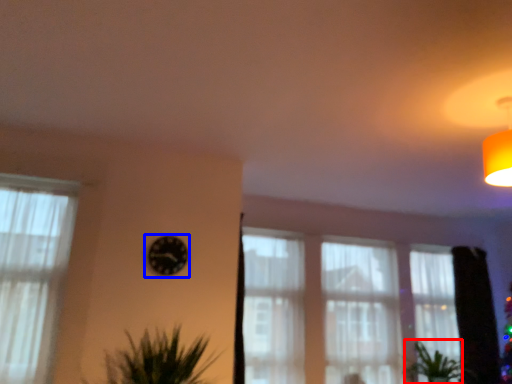
Question: Among these objects, which one is farthest to the camera, plant (highlighted by a red box) or clock (highlighted by a blue box)?

Choices:
 (A) plant
 (B) clock

Answer: (A)